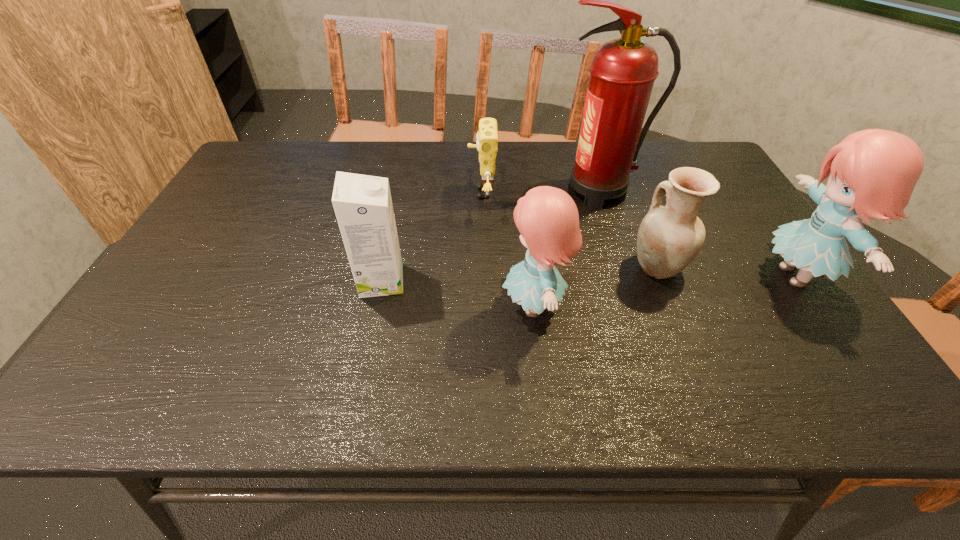
At what (x,y) coordinates should I click in order to perform the action: click on free space at the right edge. Please return your answer as a coordinate pair (x, y). The image size is (960, 540). Looking at the image, I should click on (752, 249).

Locate an element on the screen. This screenshot has width=960, height=540. free space at the far left corner of the desktop is located at coordinates (274, 153).

You are a GUI agent. You are given a task and a screenshot of the screen. Output one action in this format:
    pyautogui.click(x=<x>, y=<y>)
    Task: Click on the vacant space at the far right corner
    This screenshot has width=960, height=540.
    Given the screenshot: What is the action you would take?
    pyautogui.click(x=677, y=163)

Identify the location of vacant area between the left doll and the rightmost object. The width and height of the screenshot is (960, 540). (664, 291).

You are a GUI agent. You are given a task and a screenshot of the screen. Output one action in this format:
    pyautogui.click(x=<x>, y=<y>)
    Task: Click on the vacant area between the third object from left to right and the pottery
    
    Given the screenshot: What is the action you would take?
    pyautogui.click(x=596, y=286)

Locate an element on the screen. blank region between the tallest object and the carton is located at coordinates (491, 236).

Find the location of `free space between the tallest object and the pottery`. free space between the tallest object and the pottery is located at coordinates (629, 229).

The image size is (960, 540). Find the location of `blank region between the taller doll and the leftmost object`. blank region between the taller doll and the leftmost object is located at coordinates (588, 278).

This screenshot has height=540, width=960. Identify the location of blank region between the rightmost object and the pottery. (727, 271).

The width and height of the screenshot is (960, 540). Identify the location of free space between the carton and the shorter doll. (458, 293).